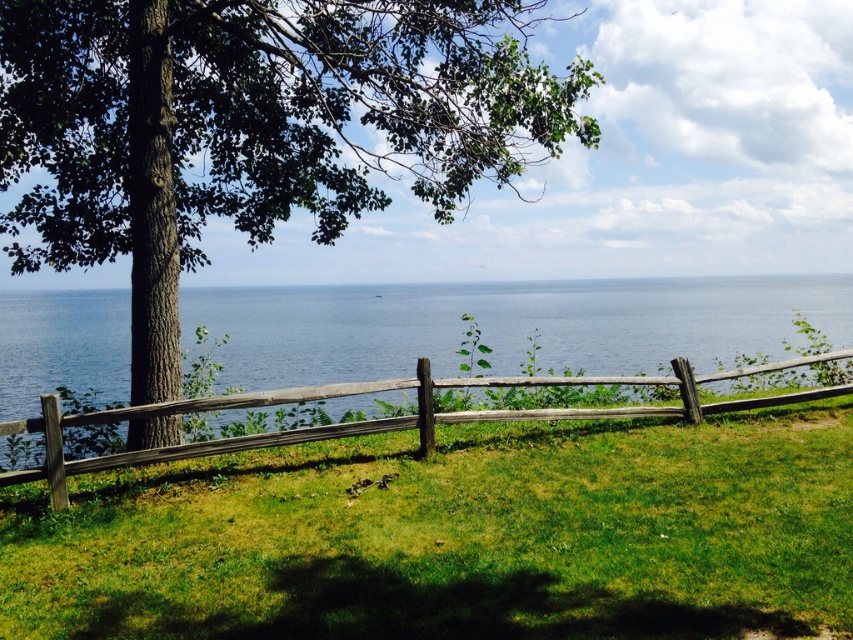
Question: Estimate the real-world distances between objects in this image. Which object is farther from the green rough bark tree at center?

Choices:
 (A) wooden split rail fence at center
 (B) green grassy at center

Answer: (B)

Question: Which point appears closest to the camera in this image?

Choices:
 (A) (485, 12)
 (B) (9, 472)

Answer: (B)

Question: Can you confirm if green rough bark tree at center is smaller than wooden split rail fence at center?

Choices:
 (A) yes
 (B) no

Answer: (B)

Question: Which object appears closest to the camera in this image?

Choices:
 (A) green rough bark tree at center
 (B) green grassy at center

Answer: (B)

Question: Can you confirm if green rough bark tree at center is positioned above wooden split rail fence at center?

Choices:
 (A) yes
 (B) no

Answer: (A)

Question: Is green rough bark tree at center behind wooden split rail fence at center?

Choices:
 (A) no
 (B) yes

Answer: (B)